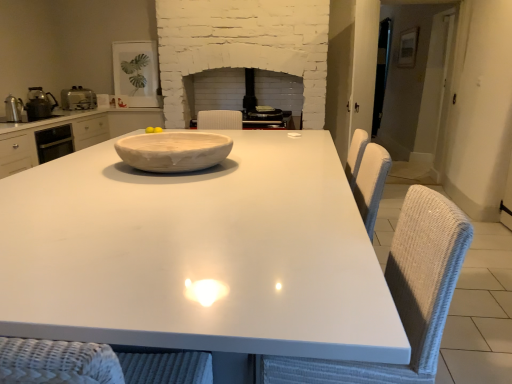
Question: Considering the relative sizes of white wicker swivel chair at right and matte white picture frame at upper left, which is counted as the 1th appliance, starting from the back, in the image provided, is white wicker swivel chair at right wider than matte white picture frame at upper left, which is counted as the 1th appliance, starting from the back,?

Choices:
 (A) no
 (B) yes

Answer: (B)

Question: Does white wicker swivel chair at right have a larger size compared to matte white picture frame at upper left, acting as the fourth appliance starting from the front?

Choices:
 (A) yes
 (B) no

Answer: (A)

Question: Is matte white picture frame at upper left, acting as the fourth appliance starting from the front, inside white wicker swivel chair at right?

Choices:
 (A) no
 (B) yes

Answer: (A)

Question: Considering the relative sizes of white wicker swivel chair at right and matte white picture frame at upper left, which is counted as the 1th appliance, starting from the back, in the image provided, is white wicker swivel chair at right taller than matte white picture frame at upper left, which is counted as the 1th appliance, starting from the back,?

Choices:
 (A) yes
 (B) no

Answer: (A)

Question: Would you consider white wicker swivel chair at right to be distant from matte white picture frame at upper left, which is counted as the 1th appliance, starting from the back?

Choices:
 (A) yes
 (B) no

Answer: (A)

Question: Is white glossy table at center inside or outside of yellow matte/yellowish smooth lemon at center?

Choices:
 (A) inside
 (B) outside

Answer: (B)

Question: Does point (66, 253) appear closer or farther from the camera than point (144, 130)?

Choices:
 (A) closer
 (B) farther

Answer: (A)

Question: In the image, is white glossy table at center positioned in front of or behind yellow matte/yellowish smooth lemon at center?

Choices:
 (A) behind
 (B) front

Answer: (B)

Question: Is white glossy table at center taller or shorter than yellow matte/yellowish smooth lemon at center?

Choices:
 (A) tall
 (B) short

Answer: (A)

Question: Considering the positions of point (41, 110) and point (429, 291), is point (41, 110) closer or farther from the camera than point (429, 291)?

Choices:
 (A) closer
 (B) farther

Answer: (B)

Question: From a real-world perspective, is metallic silver kettle at left, the second appliance positioned from the front, positioned above or below white wicker swivel chair at right?

Choices:
 (A) below
 (B) above

Answer: (B)

Question: Based on their sizes in the image, would you say metallic silver kettle at left, the second appliance positioned from the front, is bigger or smaller than white wicker swivel chair at right?

Choices:
 (A) small
 (B) big

Answer: (A)

Question: In terms of width, does metallic silver kettle at left, the 3th appliance when ordered from back to front, look wider or thinner when compared to white wicker swivel chair at right?

Choices:
 (A) thin
 (B) wide

Answer: (A)

Question: From a real-world perspective, is metallic silver kettle at left, the second appliance positioned from the front, positioned above or below satin silver toaster at left, which is counted as the 2th appliance, starting from the back?

Choices:
 (A) below
 (B) above

Answer: (B)

Question: In the image, is metallic silver kettle at left, the second appliance positioned from the front, on the left side or the right side of satin silver toaster at left, which is counted as the 2th appliance, starting from the back?

Choices:
 (A) left
 (B) right

Answer: (A)